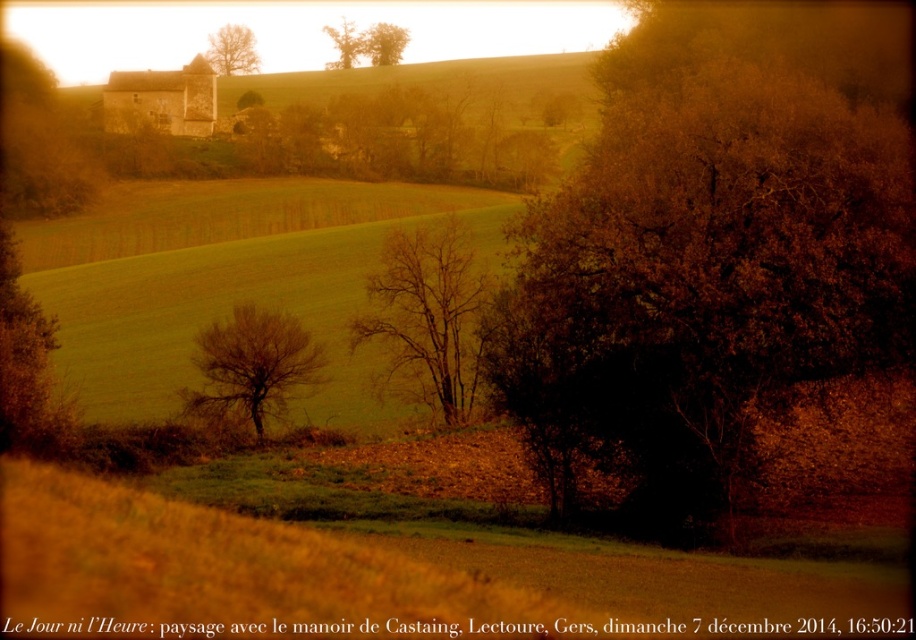
You are standing in the rural landscape and want to walk from the point closer to you to the point further away. Which path would you take between the two points, point [118,294] and point [411,368]?

You should walk from point [118,294] to point [411,368] because point [118,294] is closer to you and the other point is further away.

You are an artist sketching the landscape and want to ensure the proportions of the trees are accurate. Which of the two trees, the bare branches at center or the smooth brown tree at upper center, should you draw as taller?

The smooth brown tree at upper center should be drawn as taller since the bare branches at center has a lesser height compared to it.